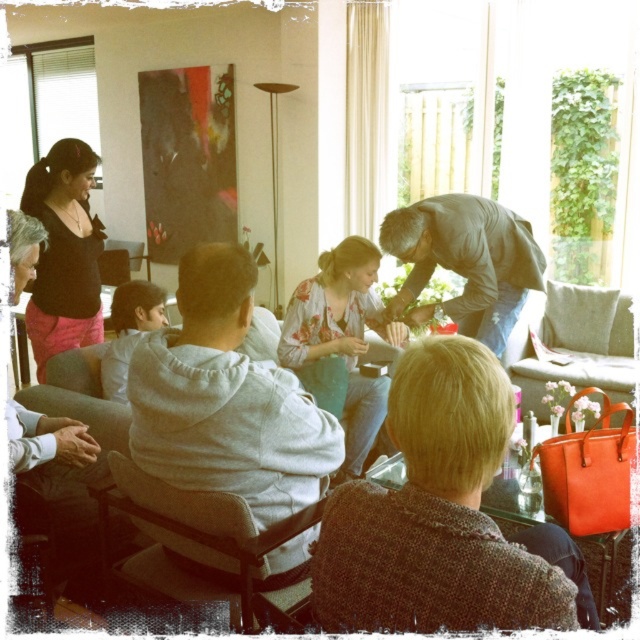
Which is in front, point (186, 284) or point (396, 236)?

Point (186, 284)

Locate an element on the screen. The image size is (640, 640). gray fleece hoodie at center is located at coordinates (227, 400).

The image size is (640, 640). I want to click on gray fleece hoodie at center, so click(227, 400).

Between point (353, 474) and point (582, 378), which one is positioned in front?

Positioned in front is point (353, 474).

Does point (355, 426) come farther from viewer compared to point (540, 333)?

No, it is not.

Find the location of `floral-patterned blouse at center`. floral-patterned blouse at center is located at coordinates (342, 337).

Is gray textured shirt at center closer to the viewer compared to matte black top at upper left?

That is False.

Which is in front, point (388, 250) or point (28, 321)?

Point (388, 250)

Find the location of `gray textured shirt at center`. gray textured shirt at center is located at coordinates (465, 262).